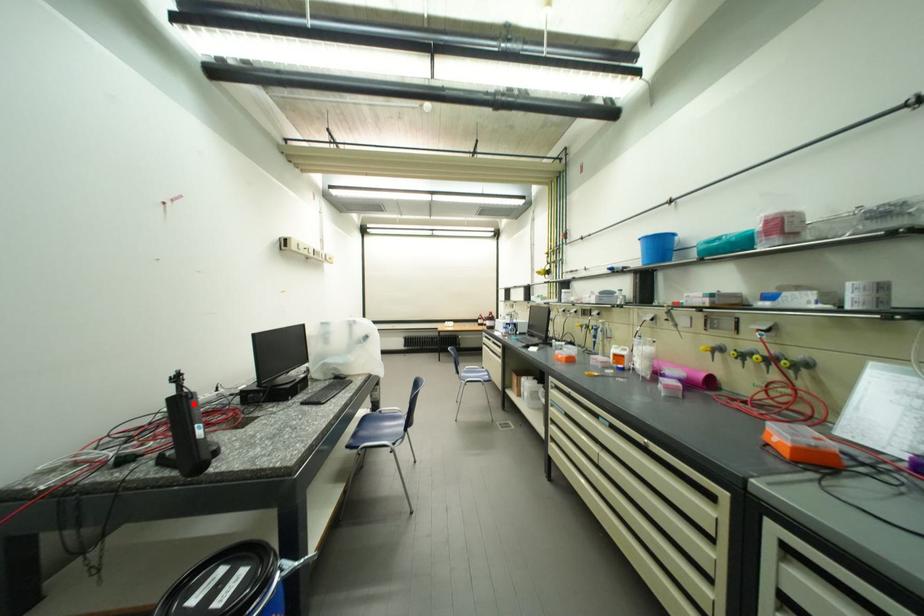
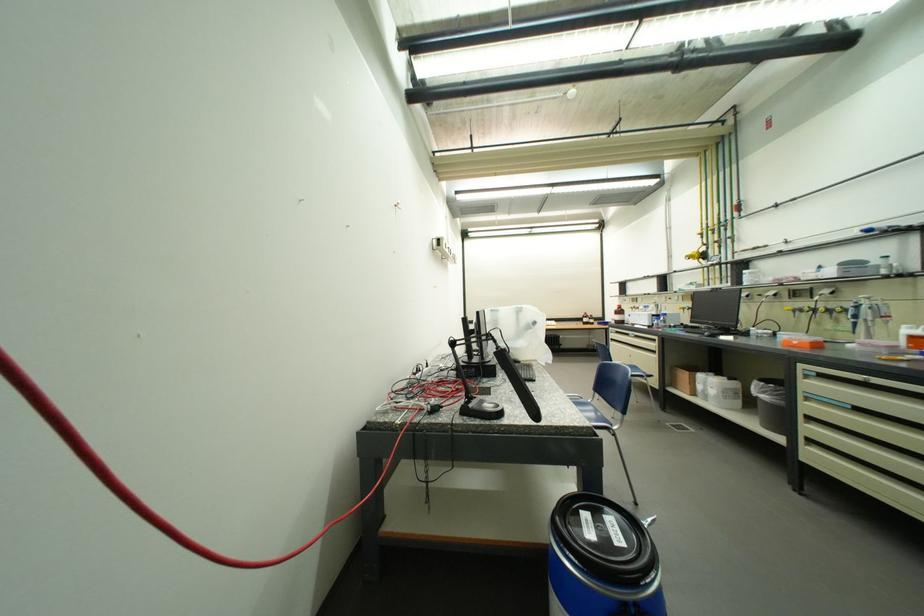
Question: I am providing you with two images of the same scene from different viewpoints. Given a red point in image1, look at the same physical point in image2. Is it:

Choices:
 (A) Closer to the viewpoint
 (B) Farther from the viewpoint

Answer: (B)